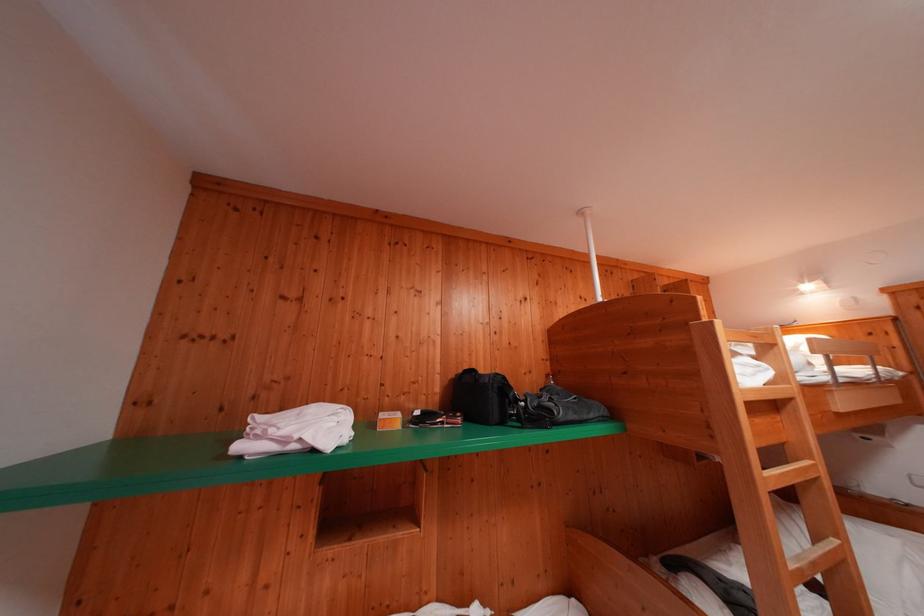
Where would you sit the chair sitting surface? Please return your answer as a coordinate pair (x, y).

(758, 363)